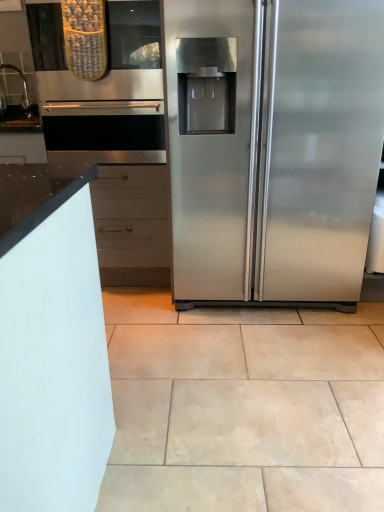
Question: Could you tell me if stainless steel refrigerator at right is facing beige ceramic tile at center?

Choices:
 (A) yes
 (B) no

Answer: (A)

Question: Is stainless steel refrigerator at right wider than beige ceramic tile at center?

Choices:
 (A) yes
 (B) no

Answer: (B)

Question: From the image's perspective, does stainless steel refrigerator at right appear higher than beige ceramic tile at center?

Choices:
 (A) yes
 (B) no

Answer: (A)

Question: Is stainless steel refrigerator at right not near beige ceramic tile at center?

Choices:
 (A) no
 (B) yes

Answer: (A)

Question: Considering the relative positions of stainless steel refrigerator at right and beige ceramic tile at center in the image provided, is stainless steel refrigerator at right to the left of beige ceramic tile at center from the viewer's perspective?

Choices:
 (A) yes
 (B) no

Answer: (B)

Question: From a real-world perspective, is stainless steel refrigerator at right over beige ceramic tile at center?

Choices:
 (A) yes
 (B) no

Answer: (A)

Question: Does beige ceramic tile at center have a greater width compared to stainless steel refrigerator at right?

Choices:
 (A) yes
 (B) no

Answer: (A)

Question: From the image's perspective, is beige ceramic tile at center on stainless steel refrigerator at right?

Choices:
 (A) yes
 (B) no

Answer: (B)

Question: Does beige ceramic tile at center have a lesser height compared to stainless steel refrigerator at right?

Choices:
 (A) yes
 (B) no

Answer: (A)

Question: Can stainless steel refrigerator at right be found inside beige ceramic tile at center?

Choices:
 (A) yes
 (B) no

Answer: (B)

Question: From a real-world perspective, is beige ceramic tile at center positioned over stainless steel refrigerator at right based on gravity?

Choices:
 (A) no
 (B) yes

Answer: (A)

Question: Is beige ceramic tile at center smaller than stainless steel refrigerator at right?

Choices:
 (A) no
 (B) yes

Answer: (B)

Question: Would you say satin nickel faucet at left contains beige ceramic tile at center?

Choices:
 (A) no
 (B) yes

Answer: (A)